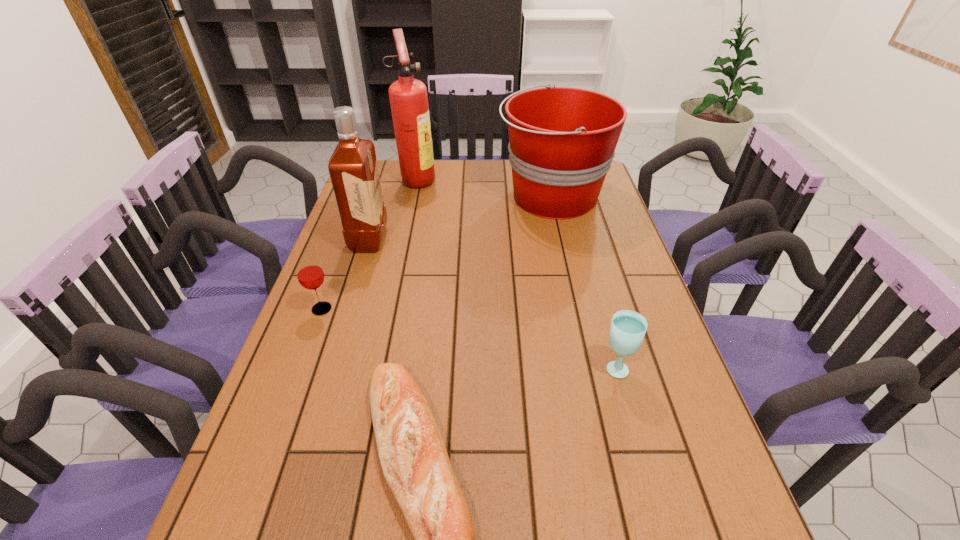
What are the coordinates of `free location located 0.070m on the front of the right glass` in the screenshot? It's located at (627, 407).

Where is `fire extinguisher situated at the far edge`? The image size is (960, 540). fire extinguisher situated at the far edge is located at coordinates (408, 97).

Where is `bucket present at the far edge`? bucket present at the far edge is located at coordinates (562, 140).

The image size is (960, 540). Identify the location of fire extinguisher that is at the left edge. (408, 97).

Locate an element on the screen. The image size is (960, 540). liquor present at the left edge is located at coordinates (353, 169).

This screenshot has width=960, height=540. I want to click on glass present at the left edge, so click(x=309, y=272).

Where is `bucket present at the right edge`? bucket present at the right edge is located at coordinates (562, 140).

Locate an element on the screen. glass present at the right edge is located at coordinates (628, 328).

Find the location of a particular element. This screenshot has height=540, width=960. object that is at the far left corner is located at coordinates (408, 97).

The image size is (960, 540). I want to click on object located at the far right corner, so click(562, 140).